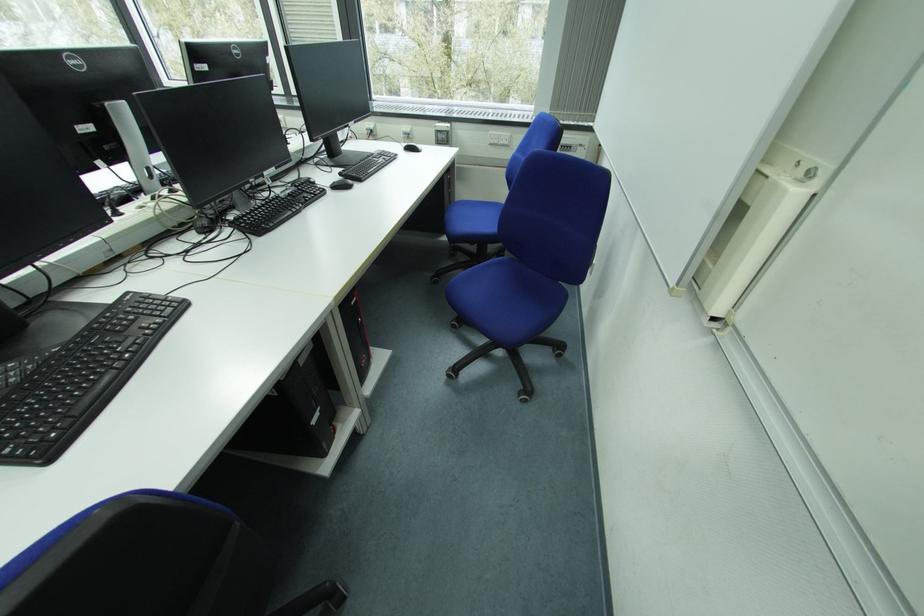
Find where to slid the black computer mouse. Please return your answer as a coordinate pair (x, y).

(341, 184)